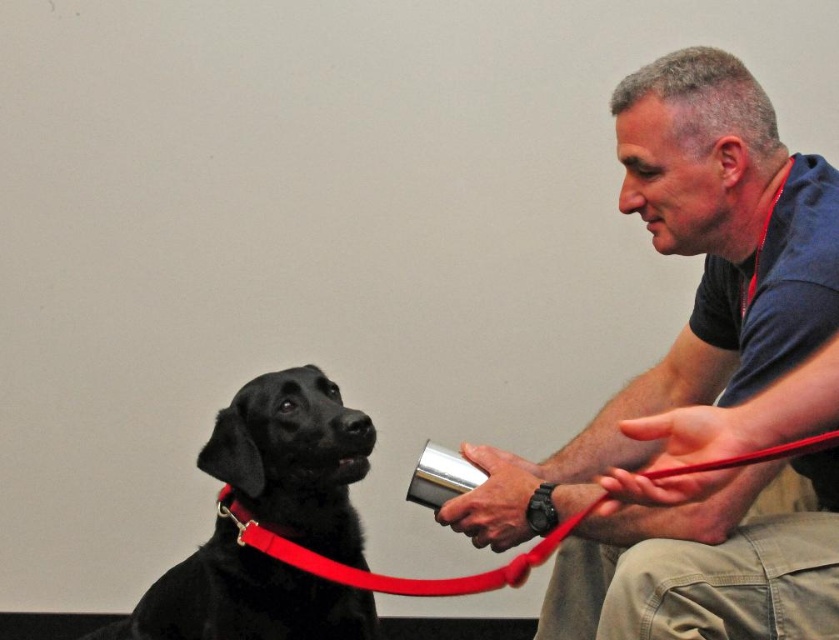
Is matte black dog at left behind black smooth dog at left?

That is False.

Is matte black dog at left taller than black smooth dog at left?

Yes.

This screenshot has height=640, width=839. What do you see at coordinates (699, 280) in the screenshot?
I see `matte black dog at left` at bounding box center [699, 280].

Locate an element on the screen. Image resolution: width=839 pixels, height=640 pixels. matte black dog at left is located at coordinates (699, 280).

Who is positioned more to the left, black smooth dog at left or red leather leash at lower left?

black smooth dog at left

The image size is (839, 640). What do you see at coordinates (294, 458) in the screenshot?
I see `black smooth dog at left` at bounding box center [294, 458].

Is point (274, 628) farther from viewer compared to point (736, 464)?

That is True.

Where is `black smooth dog at left`? The image size is (839, 640). black smooth dog at left is located at coordinates (294, 458).

Can you confirm if matte black dog at left is taller than red leather leash at lower left?

Indeed, matte black dog at left has a greater height compared to red leather leash at lower left.

Is matte black dog at left below red leather leash at lower left?

No, matte black dog at left is not below red leather leash at lower left.

Between point (749, 493) and point (598, 500), which one is positioned behind?

The point (749, 493) is more distant.

Identify the location of matte black dog at left. This screenshot has width=839, height=640. (699, 280).